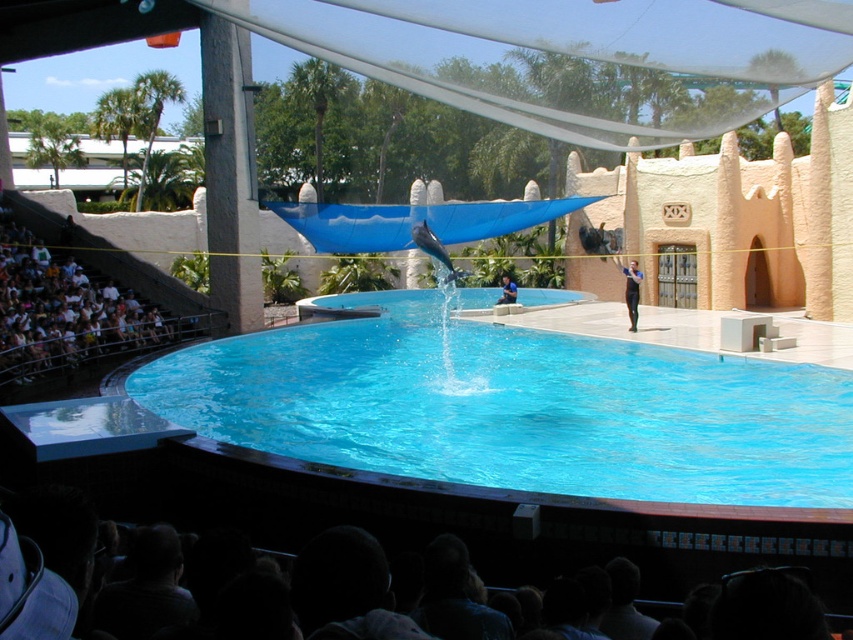
Question: Which object is closer to the camera taking this photo?

Choices:
 (A) white fabric seat at left
 (B) transparent glass pool at center
 (C) smooth gray dolphin at center

Answer: (B)

Question: Estimate the real-world distances between objects in this image. Which object is closer to the transparent glass pool at center?

Choices:
 (A) dark blue shirt at center
 (B) black wetsuit at center
 (C) white fabric seat at left

Answer: (B)

Question: Can you confirm if transparent glass pool at center is positioned to the left of black wetsuit at center?

Choices:
 (A) no
 (B) yes

Answer: (B)

Question: Does black wetsuit at center appear under dark blue shirt at center?

Choices:
 (A) no
 (B) yes

Answer: (A)

Question: Based on their relative distances, which object is nearer to the transparent glass pool at center?

Choices:
 (A) black wetsuit at center
 (B) smooth gray dolphin at center
 (C) dark blue shirt at center

Answer: (B)

Question: Can you confirm if white fabric seat at left is wider than black wetsuit at center?

Choices:
 (A) yes
 (B) no

Answer: (A)